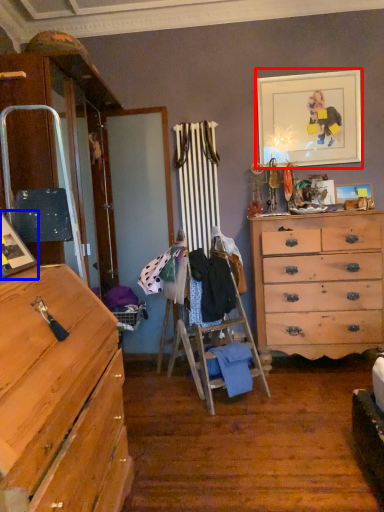
Question: Which object appears closest to the camera in this image, picture frame (highlighted by a red box) or picture frame (highlighted by a blue box)?

Choices:
 (A) picture frame
 (B) picture frame

Answer: (B)